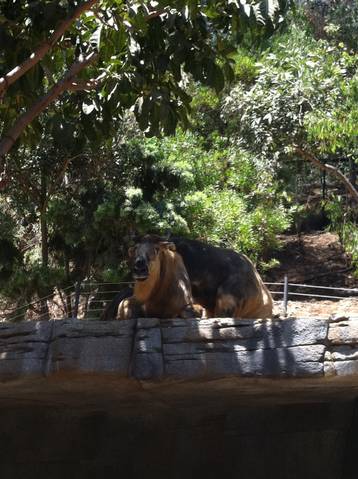
This screenshot has height=479, width=358. I want to click on wall, so click(204, 343).